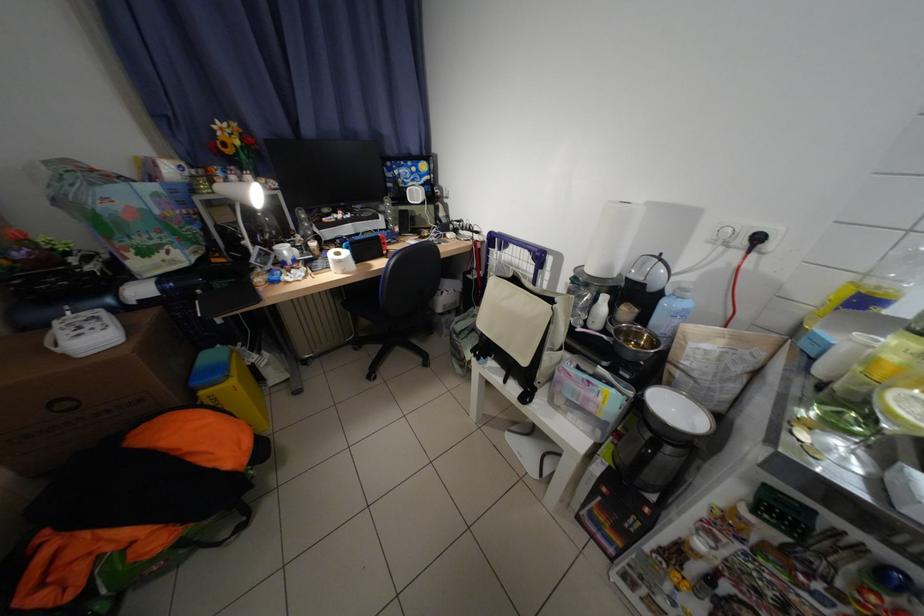
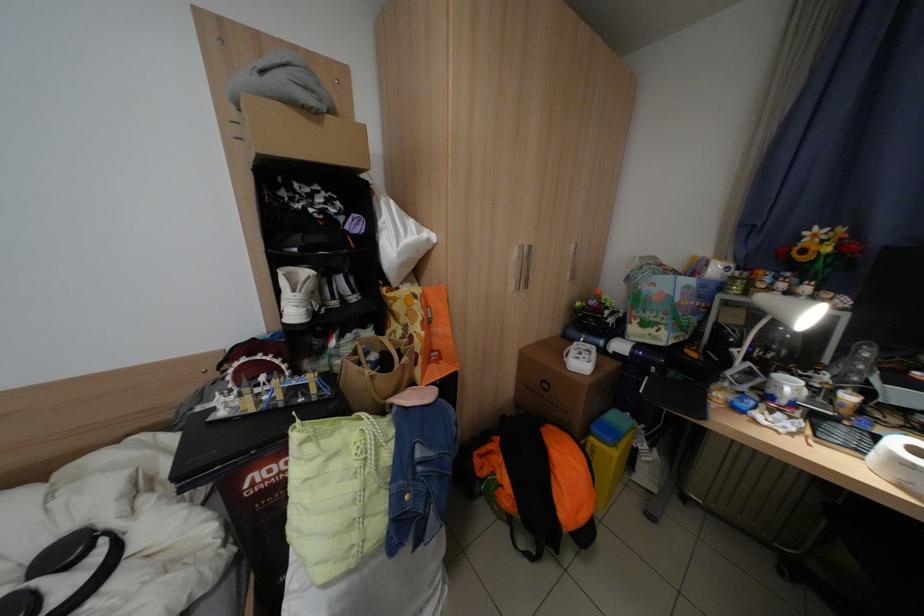
Where in the second image is the point corresponding to (297,252) from the first image?

(800, 387)